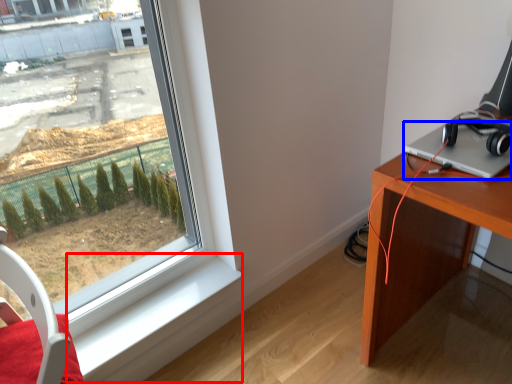
Question: Which of the following is the closest to the observer, window sill (highlighted by a red box) or laptop (highlighted by a blue box)?

Choices:
 (A) window sill
 (B) laptop

Answer: (B)